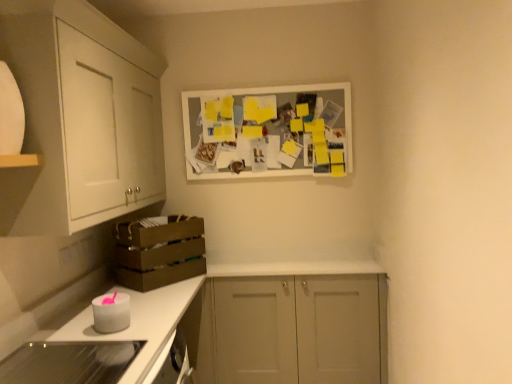
Identify the location of white matte candle at lower left, arranged as the 1th appliance when viewed from the top. pyautogui.click(x=111, y=312).

The width and height of the screenshot is (512, 384). What do you see at coordinates (69, 362) in the screenshot?
I see `glassy white stove at lower left, which is the first appliance from bottom to top` at bounding box center [69, 362].

Find the location of a particular element. white matte picture frame at upper center is located at coordinates point(268,131).

In the scene shown: What is the approximate height of white matte picture frame at upper center?

23.61 inches.

Identify the location of brown cardboard crate at lower left. Image resolution: width=512 pixels, height=384 pixels. (159, 251).

In the scene shown: Considering the positions of objects brown cardboard crate at lower left and white glossy countertop at lower left in the image provided, who is more to the left, brown cardboard crate at lower left or white glossy countertop at lower left?

From the viewer's perspective, white glossy countertop at lower left appears more on the left side.

Is brown cardboard crate at lower left facing away from white glossy countertop at lower left?

brown cardboard crate at lower left does not have its back to white glossy countertop at lower left.

Can you confirm if brown cardboard crate at lower left is smaller than white glossy countertop at lower left?

Indeed, brown cardboard crate at lower left has a smaller size compared to white glossy countertop at lower left.

From the image's perspective, which one is positioned higher, brown cardboard crate at lower left or white glossy countertop at lower left?

brown cardboard crate at lower left, from the image's perspective.

Would you say brown cardboard crate at lower left is part of white matte candle at lower left, which is the second appliance in front-to-back order,'s contents?

That's incorrect, brown cardboard crate at lower left is not inside white matte candle at lower left, which is the second appliance in front-to-back order.

Is white matte candle at lower left, the 1th appliance in the back-to-front sequence, shorter than brown cardboard crate at lower left?

Yes.

From a real-world perspective, is white matte candle at lower left, which is the second appliance in front-to-back order, over brown cardboard crate at lower left?

Actually, white matte candle at lower left, which is the second appliance in front-to-back order, is physically below brown cardboard crate at lower left in the real world.

Is white matte candle at lower left, arranged as the 1th appliance when viewed from the top, positioned far away from brown cardboard crate at lower left?

They are positioned close to each other.

In terms of width, does white matte candle at lower left, which is the second appliance in front-to-back order, look wider or thinner when compared to white glossy countertop at lower left?

Clearly, white matte candle at lower left, which is the second appliance in front-to-back order, has less width compared to white glossy countertop at lower left.

Could you tell me if white matte candle at lower left, positioned as the second appliance in bottom-to-top order, is turned towards white glossy countertop at lower left?

No.

Based on their positions, is white matte candle at lower left, which is the second appliance in front-to-back order, located to the left or right of white glossy countertop at lower left?

white matte candle at lower left, which is the second appliance in front-to-back order, is to the left of white glossy countertop at lower left.

Can you see white matte candle at lower left, the 1th appliance in the back-to-front sequence, touching white glossy countertop at lower left?

No, white matte candle at lower left, the 1th appliance in the back-to-front sequence, is not beside white glossy countertop at lower left.

From the image's perspective, is white matte cabinet at center, which is counted as the first cabinetry, starting from the right, on top of white matte candle at lower left, which is the second appliance in front-to-back order?

No.

Does white matte cabinet at center, the 2th cabinetry from the top, have a larger size compared to white matte candle at lower left, arranged as the 1th appliance when viewed from the top?

Indeed, white matte cabinet at center, the 2th cabinetry from the top, has a larger size compared to white matte candle at lower left, arranged as the 1th appliance when viewed from the top.

Is white matte cabinet at center, which is the first cabinetry in bottom-to-top order, oriented away from white matte candle at lower left, positioned as the second appliance in bottom-to-top order?

white matte cabinet at center, which is the first cabinetry in bottom-to-top order, is not turned away from white matte candle at lower left, positioned as the second appliance in bottom-to-top order.

Are brown cardboard crate at lower left and white matte picture frame at upper center beside each other?

No, brown cardboard crate at lower left is not beside white matte picture frame at upper center.

From the image's perspective, is brown cardboard crate at lower left below white matte picture frame at upper center?

Yes, from the image's perspective, brown cardboard crate at lower left is beneath white matte picture frame at upper center.

Is brown cardboard crate at lower left inside or outside of white matte picture frame at upper center?

brown cardboard crate at lower left is spatially situated outside white matte picture frame at upper center.

Is brown cardboard crate at lower left positioned with its back to white matte picture frame at upper center?

No.

Is white matte cabinet at center, which is the 2th cabinetry from left to right, inside the boundaries of white glossy countertop at lower left, or outside?

white matte cabinet at center, which is the 2th cabinetry from left to right, is located beyond the bounds of white glossy countertop at lower left.

Which is more to the left, white matte cabinet at center, which is counted as the first cabinetry, starting from the right, or white glossy countertop at lower left?

Positioned to the left is white glossy countertop at lower left.

From a real-world perspective, is white matte cabinet at center, which is the first cabinetry in bottom-to-top order, physically above white glossy countertop at lower left?

No, from a real-world perspective, white matte cabinet at center, which is the first cabinetry in bottom-to-top order, is not over white glossy countertop at lower left

Locate an element on the screen. Image resolution: width=512 pixels, height=384 pixels. countertop that is on the left side of white matte picture frame at upper center is located at coordinates (139, 323).

Is point (304, 174) more distant than point (170, 309)?

Yes, point (304, 174) is behind point (170, 309).

From the image's perspective, is white matte picture frame at upper center above or below white glossy countertop at lower left?

Based on their image positions, white matte picture frame at upper center is located above white glossy countertop at lower left.

You are a GUI agent. You are given a task and a screenshot of the screen. Output one action in this format:
    pyautogui.click(x=<x>, y=<y>)
    Task: Click on the crate above the white glossy countertop at lower left (from the image's perspective)
    The height and width of the screenshot is (384, 512).
    Given the screenshot: What is the action you would take?
    pyautogui.click(x=159, y=251)

Starting from the brown cardboard crate at lower left, which appliance is the 1st one in front? Please provide its 2D coordinates.

[(111, 312)]

When comparing their distances from glassy white stove at lower left, the second appliance viewed from the back, does white matte cabinet at center, the 2th cabinetry from the top, or white glossy countertop at lower left seem further?

Among the two, white matte cabinet at center, the 2th cabinetry from the top, is located further to glassy white stove at lower left, the second appliance viewed from the back.

Estimate the real-world distances between objects in this image. Which object is further from white matte cabinet at upper left, acting as the second cabinetry starting from the right, white matte candle at lower left, which is the second appliance in front-to-back order, or white matte cabinet at center, which is the 2th cabinetry from left to right?

white matte cabinet at center, which is the 2th cabinetry from left to right, is positioned further to the anchor white matte cabinet at upper left, acting as the second cabinetry starting from the right.

Which object lies further to the anchor point white matte picture frame at upper center, brown cardboard crate at lower left or white matte cabinet at center, which is counted as the first cabinetry, starting from the right?

white matte cabinet at center, which is counted as the first cabinetry, starting from the right.

In the scene shown: Estimate the real-world distances between objects in this image. Which object is closer to white glossy countertop at lower left, white matte cabinet at upper left, acting as the second cabinetry starting from the right, or white matte candle at lower left, which is the second appliance in front-to-back order?

white matte candle at lower left, which is the second appliance in front-to-back order, lies closer to white glossy countertop at lower left than the other object.

From the image, which object appears to be farther from white matte picture frame at upper center, white glossy countertop at lower left or white matte cabinet at center, which is counted as the first cabinetry, starting from the right?

Among the two, white glossy countertop at lower left is located further to white matte picture frame at upper center.

Based on their spatial positions, is white matte cabinet at upper left, the first cabinetry from the left, or white matte picture frame at upper center closer to glassy white stove at lower left, the second appliance viewed from the back?

white matte cabinet at upper left, the first cabinetry from the left, lies closer to glassy white stove at lower left, the second appliance viewed from the back, than the other object.

Consider the image. Estimate the real-world distances between objects in this image. Which object is further from white matte cabinet at center, the 2th cabinetry from the top, white glossy countertop at lower left or white matte picture frame at upper center?

white matte picture frame at upper center lies further to white matte cabinet at center, the 2th cabinetry from the top, than the other object.

When comparing their distances from white matte cabinet at upper left, the first cabinetry viewed from the top, does white matte cabinet at center, the 2th cabinetry from the top, or white glossy countertop at lower left seem closer?

white glossy countertop at lower left is closer to white matte cabinet at upper left, the first cabinetry viewed from the top.

Find the location of a particular element. appliance that lies between white matte cabinet at upper left, the first cabinetry from the left, and glassy white stove at lower left, which is the first appliance from bottom to top, from top to bottom is located at coordinates (111, 312).

Where is `appliance between white matte cabinet at upper left, which is the second cabinetry in bottom-to-top order, and white matte picture frame at upper center in the front-back direction`? appliance between white matte cabinet at upper left, which is the second cabinetry in bottom-to-top order, and white matte picture frame at upper center in the front-back direction is located at coordinates (111, 312).

Where is `countertop between white matte picture frame at upper center and white matte cabinet at center, which is the first cabinetry in bottom-to-top order, in the vertical direction`? The height and width of the screenshot is (384, 512). countertop between white matte picture frame at upper center and white matte cabinet at center, which is the first cabinetry in bottom-to-top order, in the vertical direction is located at coordinates [139, 323].

You are a GUI agent. You are given a task and a screenshot of the screen. Output one action in this format:
    pyautogui.click(x=<x>, y=<y>)
    Task: Click on the crate between white matte picture frame at upper center and white glossy countertop at lower left from top to bottom
    The height and width of the screenshot is (384, 512).
    Given the screenshot: What is the action you would take?
    pyautogui.click(x=159, y=251)